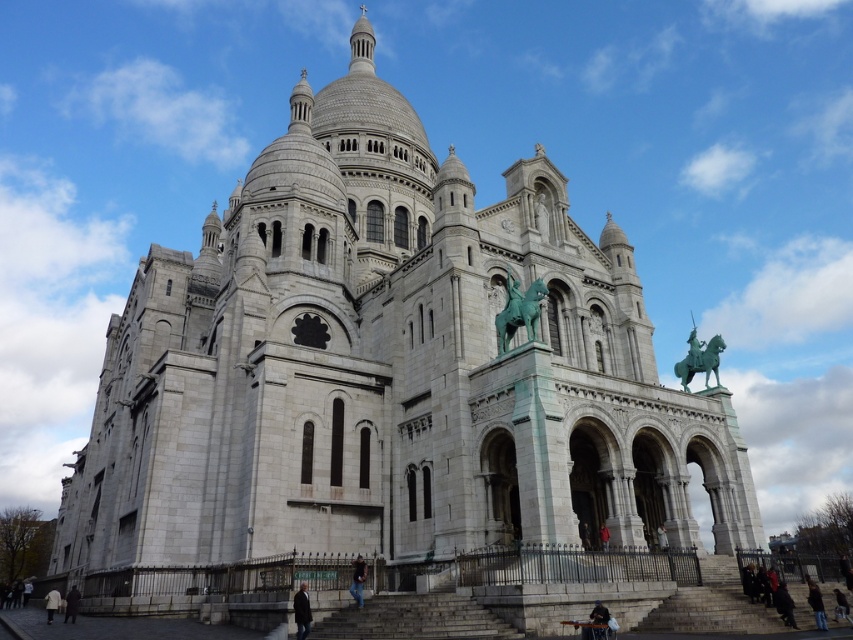
Describe the element at coordinates (518, 310) in the screenshot. The image size is (853, 640). I see `green patina metal horse at upper center` at that location.

Which is above, green patina metal horse at upper center or green patina statue at upper right?

Positioned higher is green patina metal horse at upper center.

This screenshot has height=640, width=853. In order to click on green patina metal horse at upper center in this screenshot , I will do `click(518, 310)`.

The height and width of the screenshot is (640, 853). Find the location of `green patina metal horse at upper center`. green patina metal horse at upper center is located at coordinates (518, 310).